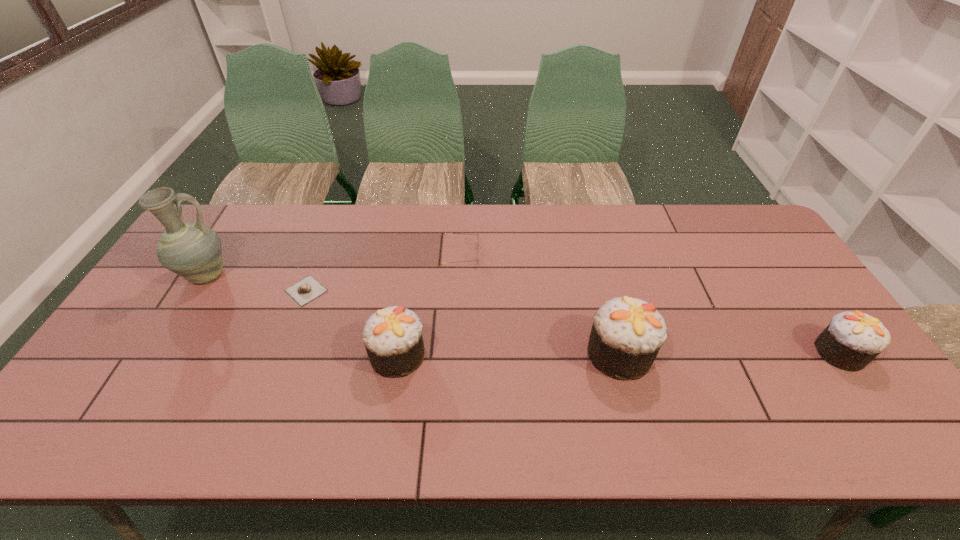
You are a GUI agent. You are given a task and a screenshot of the screen. Output one action in this format:
    pyautogui.click(x=<x>, y=<y>)
    Task: Click on the second tallest cupcake
    
    Given the screenshot: What is the action you would take?
    [392, 336]

At what (x,y) coordinates should I click in order to perform the action: click on the third object from left to right. Please return your answer as a coordinate pair (x, y). The width and height of the screenshot is (960, 540). Looking at the image, I should click on (392, 336).

Locate an element on the screen. the second cupcake from right to left is located at coordinates (627, 333).

Image resolution: width=960 pixels, height=540 pixels. Find the location of `the shortest cupcake`. the shortest cupcake is located at coordinates (852, 340).

Where is `the fourth tallest object`? the fourth tallest object is located at coordinates (852, 340).

The width and height of the screenshot is (960, 540). I want to click on the fifth object from right to left, so click(x=307, y=289).

Where is `the shortest object`? Image resolution: width=960 pixels, height=540 pixels. the shortest object is located at coordinates (307, 289).

At what (x,y) coordinates should I click in order to perform the action: click on the leftmost object. Please return your answer as a coordinate pair (x, y). The image size is (960, 540). Looking at the image, I should click on (192, 250).

I want to click on pitcher, so click(192, 250).

Image resolution: width=960 pixels, height=540 pixels. Identify the location of the fifth tallest object. (445, 233).